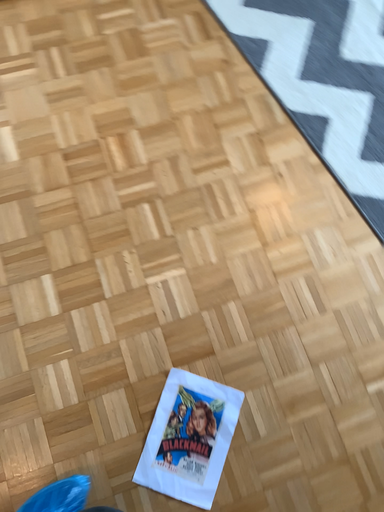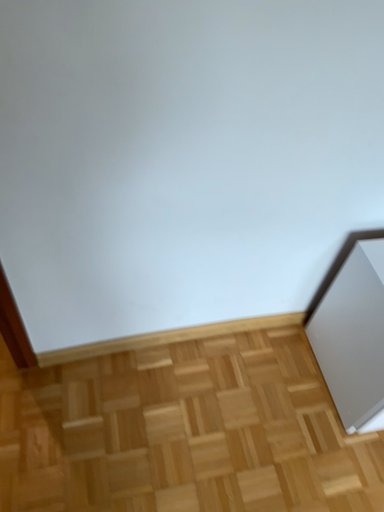
Question: How did the camera likely rotate when shooting the video?

Choices:
 (A) rotated downward
 (B) rotated upward

Answer: (B)